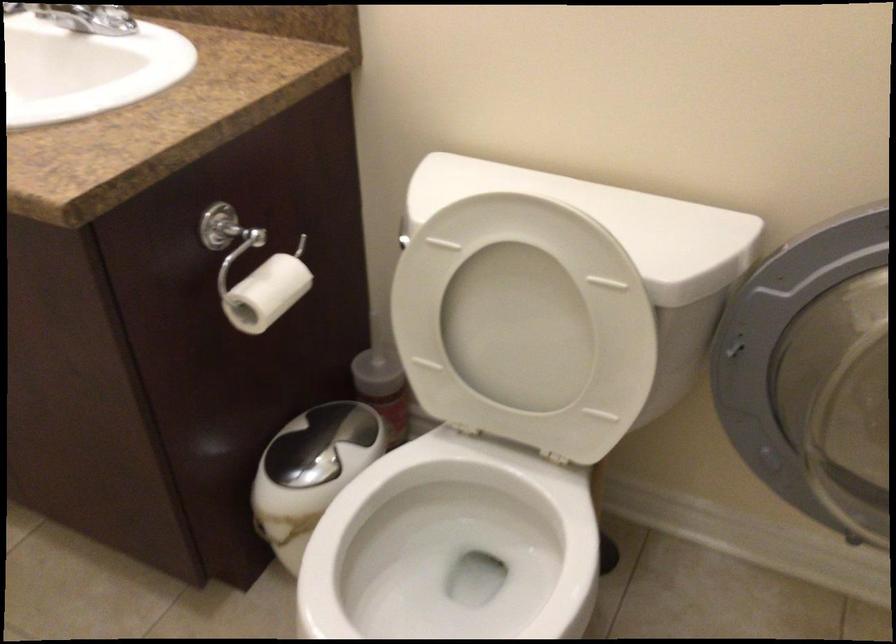
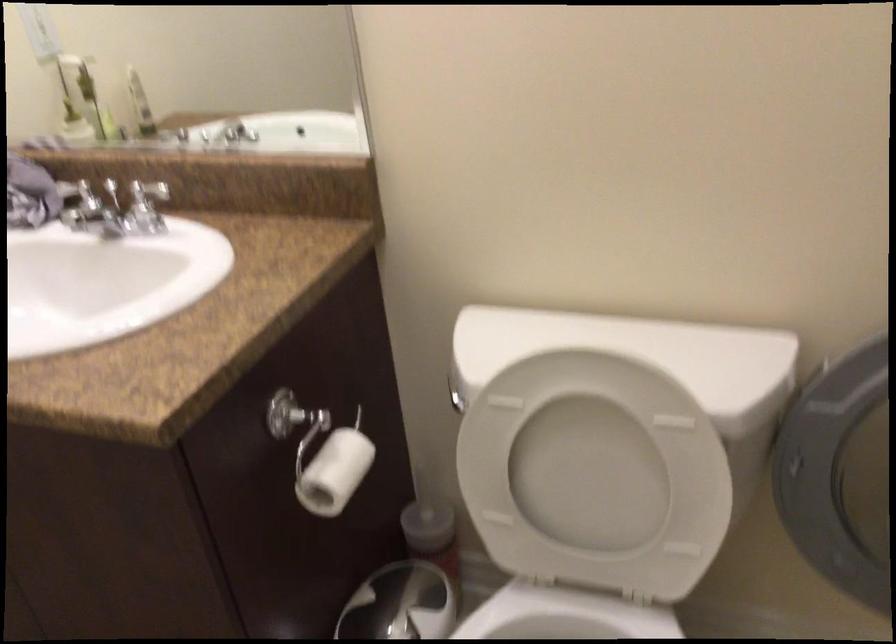
Locate, in the second image, the point that corresponds to (263,295) in the first image.

(334, 471)